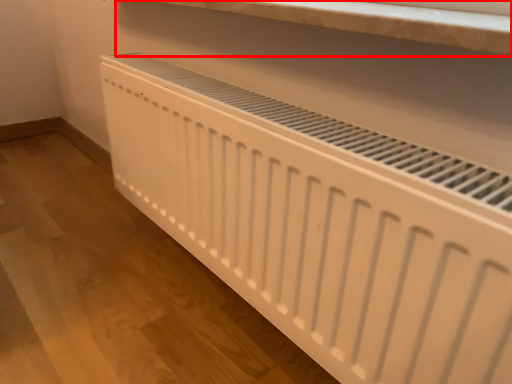
Question: From the image, what is the correct spatial relationship of shelf (annotated by the red box) in relation to home appliance?

Choices:
 (A) left
 (B) right

Answer: (B)